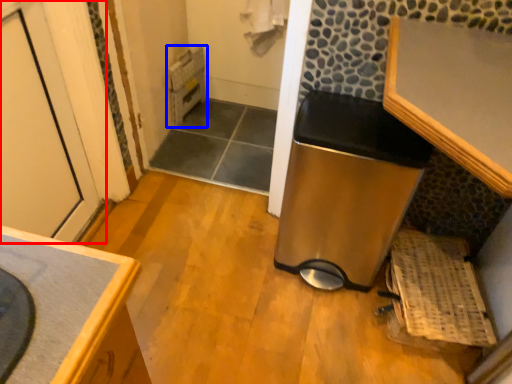
Question: Among these objects, which one is nearest to the camera, door (highlighted by a red box) or water heater (highlighted by a blue box)?

Choices:
 (A) door
 (B) water heater

Answer: (A)